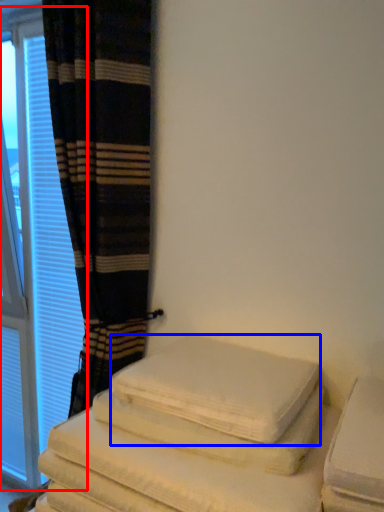
Question: Which object appears closest to the camera in this image, window (highlighted by a red box) or bath towel (highlighted by a blue box)?

Choices:
 (A) window
 (B) bath towel

Answer: (B)